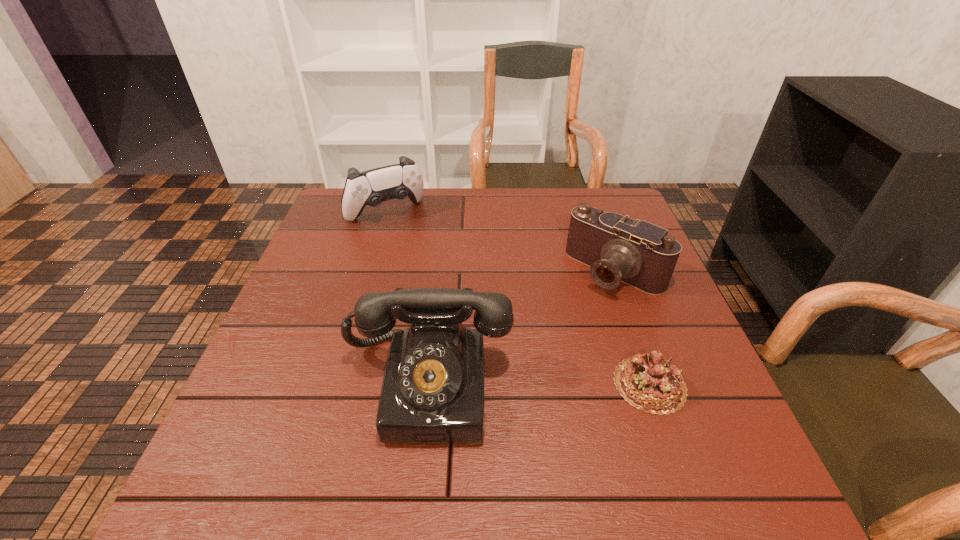
The height and width of the screenshot is (540, 960). I want to click on free space located 0.110m on the front-facing side of the farthest object, so click(417, 248).

The width and height of the screenshot is (960, 540). I want to click on object that is at the far edge, so click(x=372, y=187).

Identify the location of telephone present at the near edge. pos(432,392).

Identify the location of chocolate cake located at the near edge. The image size is (960, 540). point(650,383).

Find the location of `object located at the left edge`. object located at the left edge is located at coordinates (372, 187).

You are a GUI agent. You are given a task and a screenshot of the screen. Output one action in this format:
    pyautogui.click(x=<x>, y=<y>)
    Task: Click on the chocolate cake that is at the right edge
    This screenshot has height=540, width=960.
    Given the screenshot: What is the action you would take?
    [650, 383]

At what (x,y) coordinates should I click in order to perform the action: click on camera present at the right edge. Please return your answer as a coordinate pair (x, y). Looking at the image, I should click on (618, 249).

This screenshot has height=540, width=960. I want to click on object located in the far left corner section of the desktop, so click(372, 187).

The width and height of the screenshot is (960, 540). What are the coordinates of `object that is positioned at the near right corner` in the screenshot? It's located at (650, 383).

This screenshot has width=960, height=540. In the image, there is a desktop. Find the location of `vacant space at the far edge`. vacant space at the far edge is located at coordinates tap(465, 203).